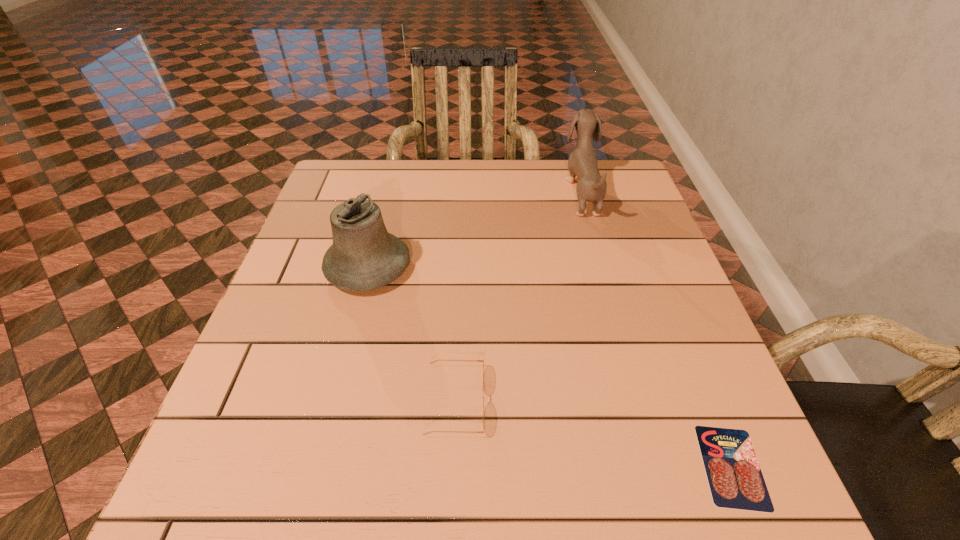
Identify the location of empty space between the salami and the third nearest object. The width and height of the screenshot is (960, 540). (550, 367).

You are a GUI agent. You are given a task and a screenshot of the screen. Output one action in this format:
    pyautogui.click(x=<x>, y=<y>)
    Task: Click on the vacant area between the leftmost object and the salami
    This screenshot has height=540, width=960.
    Given the screenshot: What is the action you would take?
    click(x=550, y=367)

I want to click on free spot between the second farthest object and the salami, so click(550, 367).

Where is `free space between the sunglasses and the second object from right to left`? The image size is (960, 540). free space between the sunglasses and the second object from right to left is located at coordinates (518, 296).

I want to click on vacant space that's between the rightmost object and the third object from left to right, so click(x=657, y=329).

I want to click on vacant space that's between the second farthest object and the puppy, so click(475, 230).

Locate an element on the screen. The height and width of the screenshot is (540, 960). free space between the rightmost object and the second shortest object is located at coordinates (593, 434).

Identify which object is the third nearest to the leftmost object. Please provide its 2D coordinates. Your answer should be formatted as a tuple, i.e. [(x, y)], where the tuple contains the x and y coordinates of a point satisfying the conditions above.

[(734, 475)]

The height and width of the screenshot is (540, 960). In order to click on object that stands as the third closest to the second object from left to right in this screenshot , I will do `click(591, 186)`.

Where is `vacant space that satisfies the following two spatial constraints: 1. on the face of the third object from right to left; 2. on the back side of the salami`? This screenshot has height=540, width=960. vacant space that satisfies the following two spatial constraints: 1. on the face of the third object from right to left; 2. on the back side of the salami is located at coordinates (452, 467).